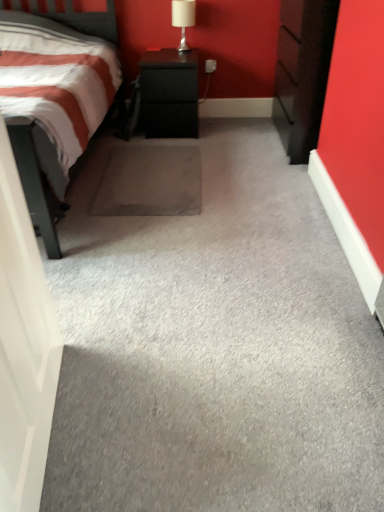
Where is `blank area beneath white glossy door at left (from a real-world perspective)`? Image resolution: width=384 pixels, height=512 pixels. blank area beneath white glossy door at left (from a real-world perspective) is located at coordinates point(56,429).